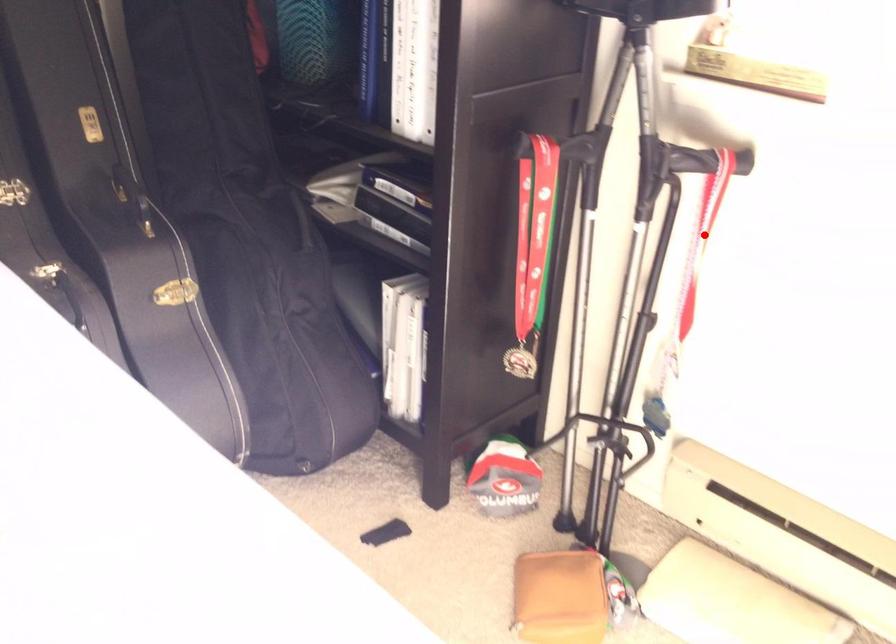
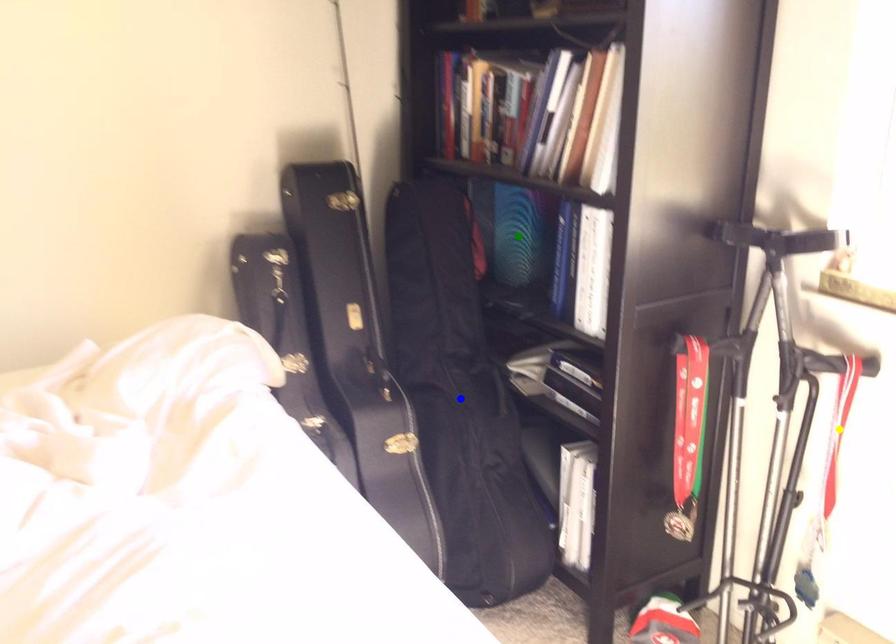
Question: I am providing you with two images of the same scene from different viewpoints. A red point is marked on the first image. You are given multiple points on the second image. Which spot in image 2 lines up with the point in image 1?

Choices:
 (A) green point
 (B) blue point
 (C) yellow point

Answer: (C)